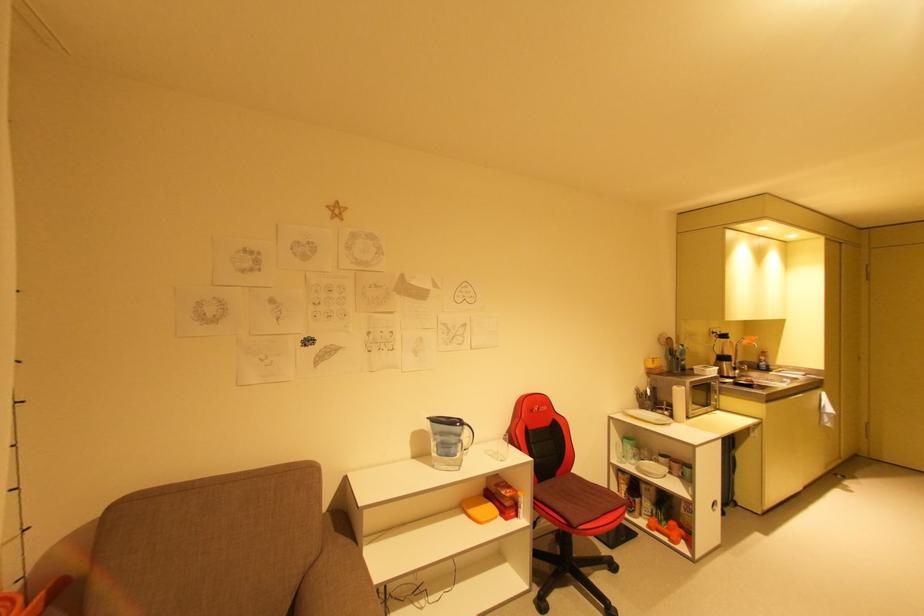
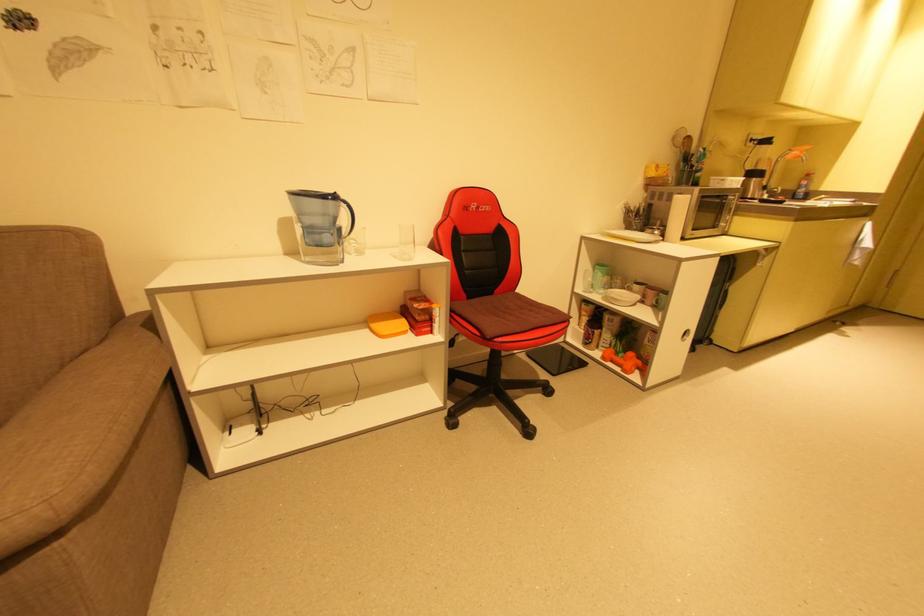
Locate, in the second image, the point that corresponds to point (468, 517) in the first image.

(371, 331)